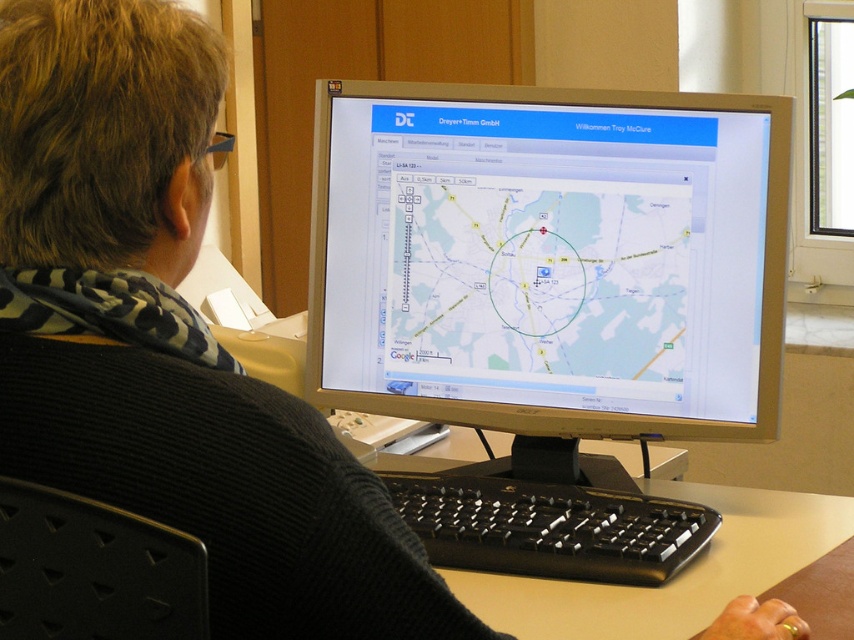
You are trying to determine which object takes up more space on the desk in the image. Which one is bigger between the transparent map at center and the black plastic keyboard at center?

The transparent map at center is larger in size than the black plastic keyboard at center, so the transparent map at center takes up more space on the desk.

You are trying to locate the transparent map at center in the image. According to the coordinates provided, where exactly is it positioned?

The transparent map at center is located at point coordinates of (534,284).